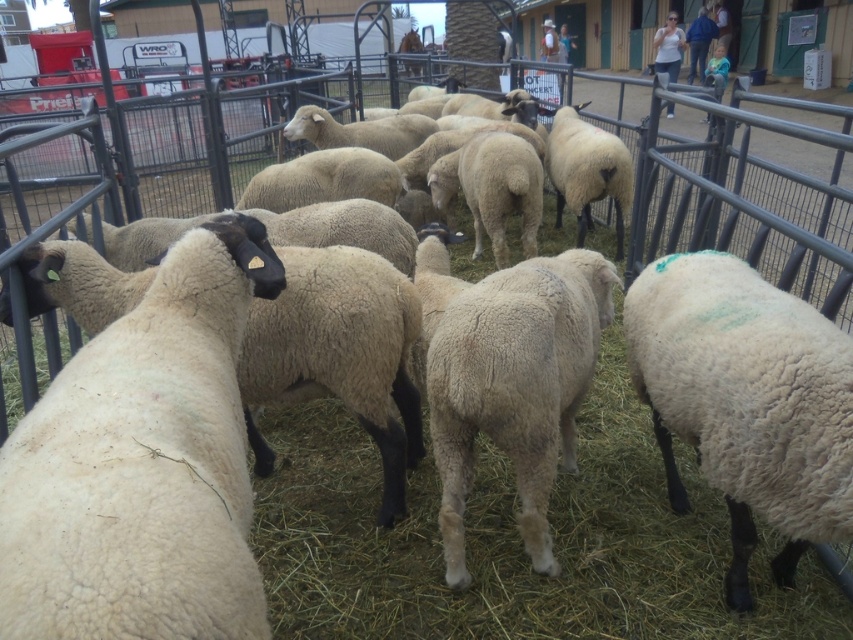
You are standing at the center of the pen. Where is the white woolen sheep at left located relative to your position?

The white woolen sheep at left is located at point (143, 465) relative to the center of the pen.

You are standing at the center of the pen and want to approach the white woolen sheep at right. Which direction should you move to reach it?

The white woolen sheep at right is located at point (746,401), so you should move towards the right side of the pen to reach it.